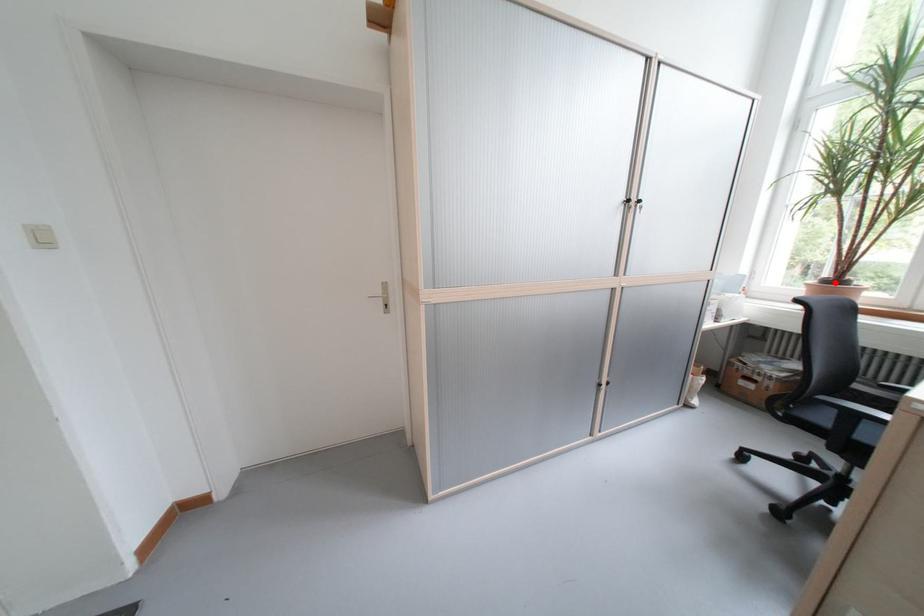
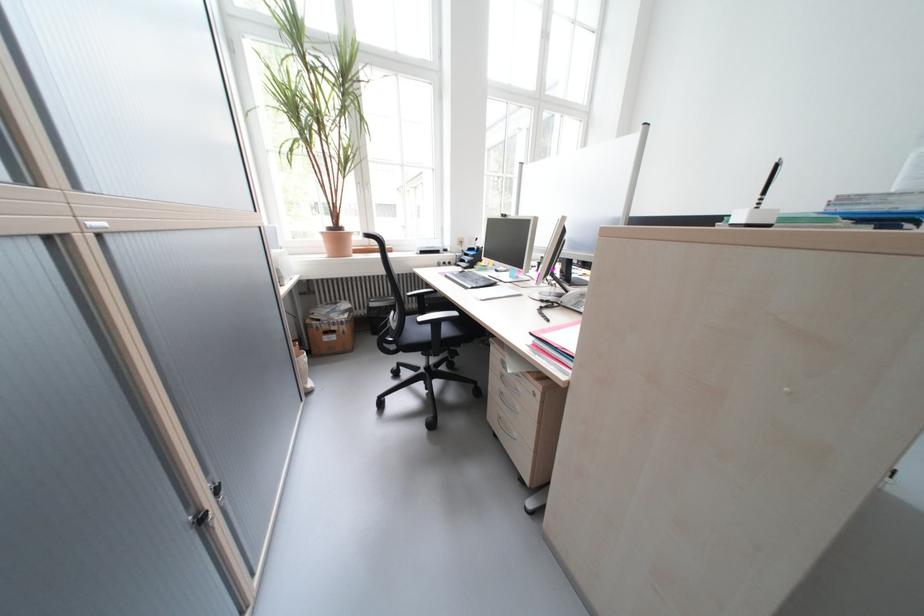
Locate, in the second image, the point that corresponds to the highlighted location in the first image.

(339, 231)